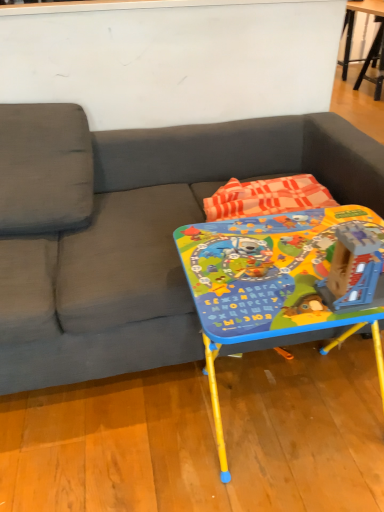
Find the location of a particular element. vacant space underneath matte plastic table at center, arranged as the first table when ordered from the bottom (from a real-world perspective) is located at coordinates (280, 403).